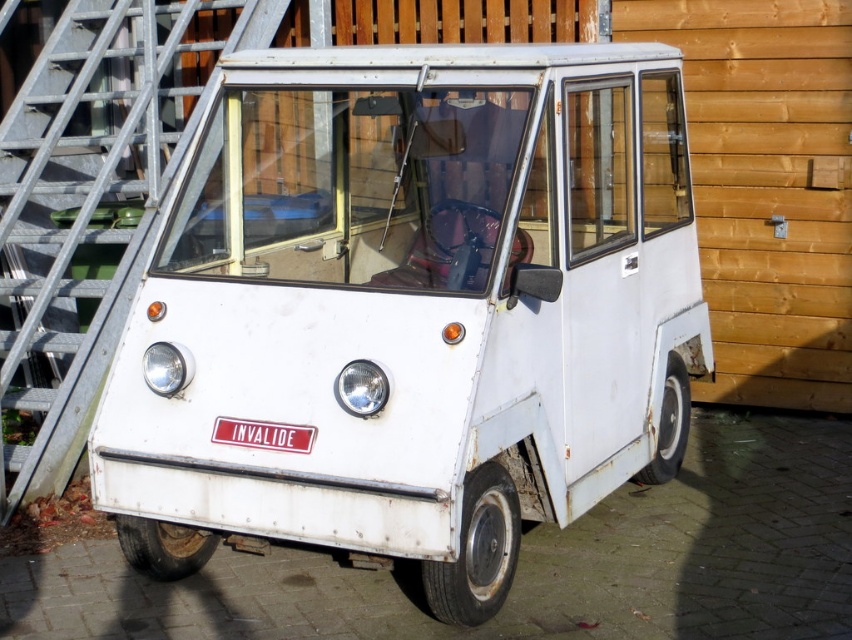
From the picture: Is white matte van at center to the right of red rubber license plate at center from the viewer's perspective?

Correct, you'll find white matte van at center to the right of red rubber license plate at center.

Where is `white matte van at center`? The height and width of the screenshot is (640, 852). white matte van at center is located at coordinates (412, 308).

The image size is (852, 640). In order to click on white matte van at center in this screenshot , I will do `click(412, 308)`.